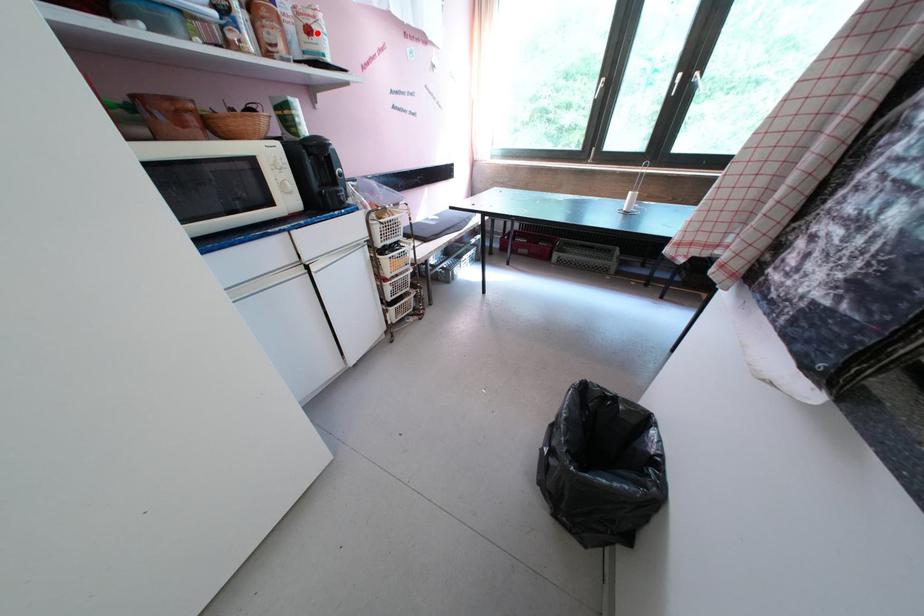
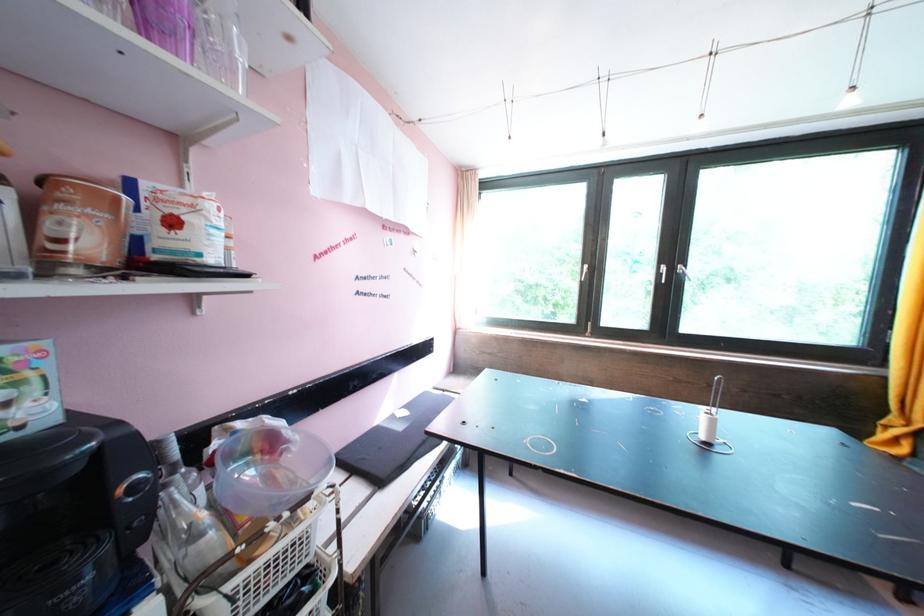
Locate, in the second image, the point that corresponds to the highlighted location in the first image.

(181, 225)